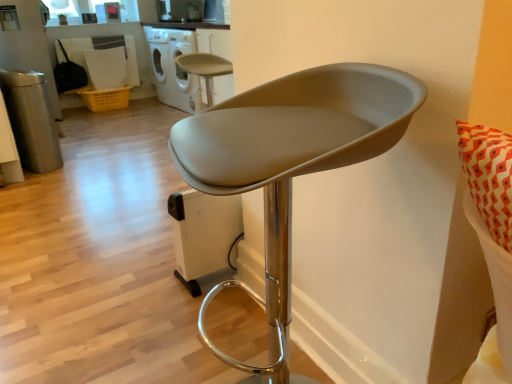
Question: Does matte gray stool at center, which is the first chair from back to front, have a smaller size compared to white glossy dishwasher at upper center?

Choices:
 (A) yes
 (B) no

Answer: (A)

Question: Considering the relative sizes of matte gray stool at center, placed as the 2th chair when sorted from right to left, and white glossy dishwasher at upper center in the image provided, is matte gray stool at center, placed as the 2th chair when sorted from right to left, bigger than white glossy dishwasher at upper center?

Choices:
 (A) no
 (B) yes

Answer: (A)

Question: From the image's perspective, would you say matte gray stool at center, the 2th chair viewed from the front, is positioned over white glossy dishwasher at upper center?

Choices:
 (A) no
 (B) yes

Answer: (A)

Question: From a real-world perspective, is matte gray stool at center, placed as the 2th chair when sorted from right to left, under white glossy dishwasher at upper center?

Choices:
 (A) yes
 (B) no

Answer: (A)

Question: From a real-world perspective, is matte gray stool at center, which is the first chair from back to front, on white glossy dishwasher at upper center?

Choices:
 (A) yes
 (B) no

Answer: (B)

Question: Is matte gray stool at center, which is the 1th chair in top-to-bottom order, positioned far away from white glossy dishwasher at upper center?

Choices:
 (A) no
 (B) yes

Answer: (A)

Question: Could you tell me if white glossy dishwasher at upper center is facing matte gray stool at center, placed as the 1th chair when sorted from right to left?

Choices:
 (A) yes
 (B) no

Answer: (B)

Question: Is the position of white glossy dishwasher at upper center more distant than that of matte gray stool at center, the second chair from the back?

Choices:
 (A) yes
 (B) no

Answer: (A)

Question: Considering the relative sizes of white glossy dishwasher at upper center and matte gray stool at center, which is the 2th chair from top to bottom, in the image provided, is white glossy dishwasher at upper center thinner than matte gray stool at center, which is the 2th chair from top to bottom,?

Choices:
 (A) no
 (B) yes

Answer: (A)

Question: Considering the relative sizes of white glossy dishwasher at upper center and matte gray stool at center, the 1th chair from the front, in the image provided, is white glossy dishwasher at upper center shorter than matte gray stool at center, the 1th chair from the front,?

Choices:
 (A) yes
 (B) no

Answer: (B)

Question: Are white glossy dishwasher at upper center and matte gray stool at center, placed as the 1th chair when sorted from right to left, beside each other?

Choices:
 (A) yes
 (B) no

Answer: (B)

Question: From a real-world perspective, is white glossy dishwasher at upper center under matte gray stool at center, which is the 2th chair from top to bottom?

Choices:
 (A) no
 (B) yes

Answer: (A)

Question: Does matte gray stool at center, the 1th chair from the front, contain matte gray stool at center, the 2th chair viewed from the front?

Choices:
 (A) yes
 (B) no

Answer: (B)